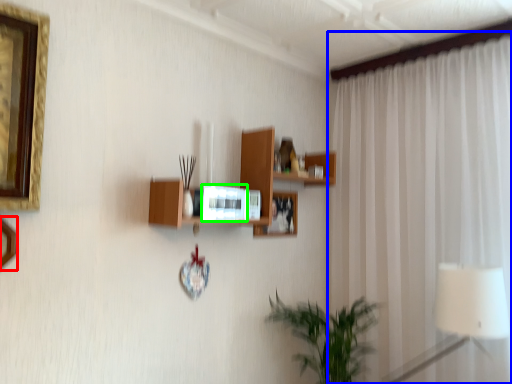
Question: Which object is the closest to the picture frame (highlighted by a red box)? Choose among these: curtain (highlighted by a blue box) or picture frame (highlighted by a green box).

Choices:
 (A) curtain
 (B) picture frame

Answer: (B)